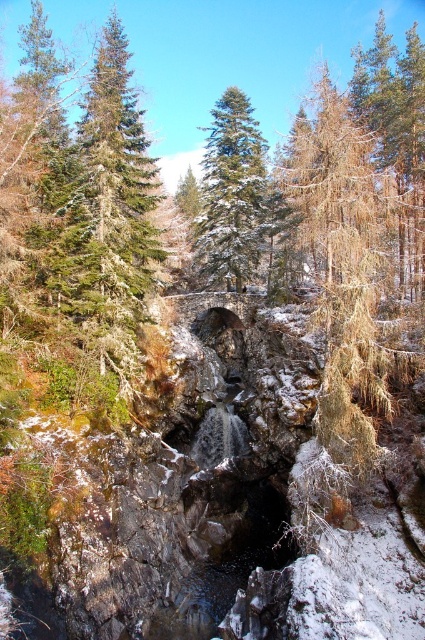
Question: Is the position of green textured pine tree at upper left less distant than that of green matte evergreen tree at center?

Choices:
 (A) no
 (B) yes

Answer: (B)

Question: Is green textured pine tree at upper left thinner than green matte evergreen tree at center?

Choices:
 (A) yes
 (B) no

Answer: (A)

Question: Among these points, which one is nearest to the camera?

Choices:
 (A) 221,97
 (B) 99,182

Answer: (B)

Question: Is green textured pine tree at upper left to the right of green matte evergreen tree at center from the viewer's perspective?

Choices:
 (A) no
 (B) yes

Answer: (A)

Question: Which of the following is the closest to the observer?

Choices:
 (A) [249, 164]
 (B) [122, 342]

Answer: (B)